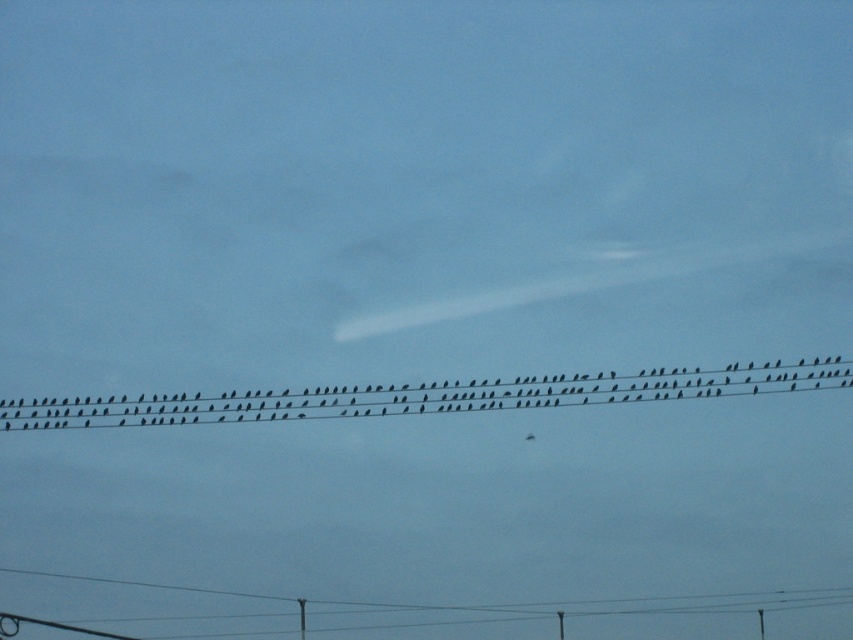
Question: Which of the following is the farthest from the observer?

Choices:
 (A) (759, 636)
 (B) (291, 416)

Answer: (B)

Question: Which point appears closest to the camera in this image?

Choices:
 (A) (328, 413)
 (B) (759, 609)

Answer: (B)

Question: Among these points, which one is nearest to the camera?

Choices:
 (A) (x=758, y=624)
 (B) (x=838, y=365)

Answer: (A)

Question: Can you confirm if black matte birds at center is positioned above smooth gray telegraph pole at lower right?

Choices:
 (A) yes
 (B) no

Answer: (A)

Question: Where is black matte birds at center located in relation to smooth gray telegraph pole at lower right in the image?

Choices:
 (A) below
 (B) above

Answer: (B)

Question: Can you confirm if black matte birds at center is positioned below smooth gray telegraph pole at lower right?

Choices:
 (A) yes
 (B) no

Answer: (B)